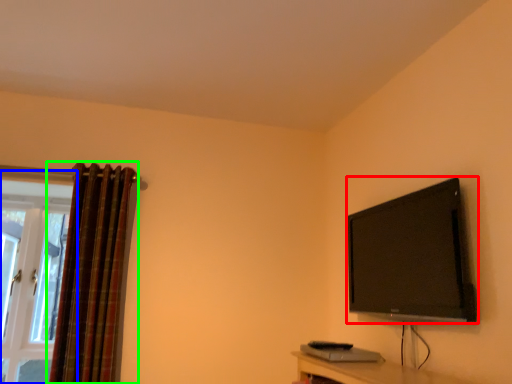
Question: Considering the real-world distances, which object is closest to television (highlighted by a red box)? window (highlighted by a blue box) or curtain (highlighted by a green box).

Choices:
 (A) window
 (B) curtain

Answer: (B)